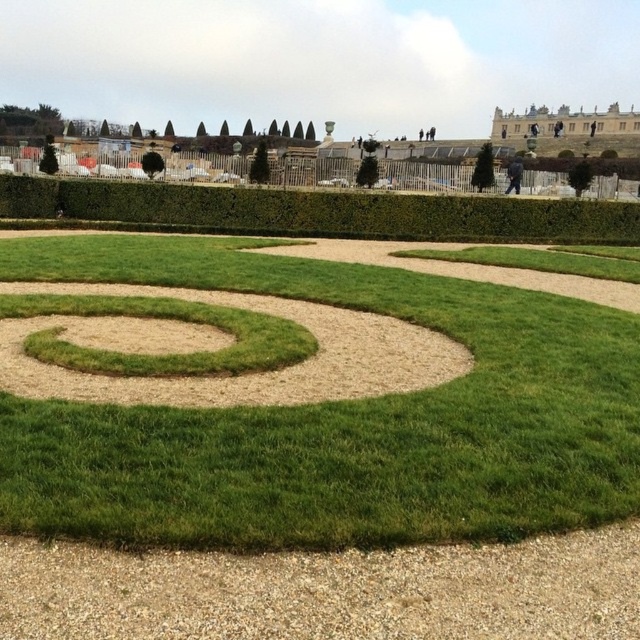
Can you confirm if gray gravel at bottom is shorter than green grass spiral at center?

In fact, gray gravel at bottom may be taller than green grass spiral at center.

Between gray gravel at bottom and green grass spiral at center, which one has more height?

gray gravel at bottom is taller.

This screenshot has width=640, height=640. In order to click on gray gravel at bottom in this screenshot , I will do `click(326, 592)`.

This screenshot has width=640, height=640. I want to click on gray gravel at bottom, so click(326, 592).

Is point (48, 180) closer to camera compared to point (445, 368)?

No.

You are a GUI agent. You are given a task and a screenshot of the screen. Output one action in this format:
    pyautogui.click(x=<x>, y=<y>)
    Task: Click on the green hedge at upper center
    Image resolution: width=640 pixels, height=640 pixels.
    Given the screenshot: What is the action you would take?
    pyautogui.click(x=317, y=212)

The height and width of the screenshot is (640, 640). In order to click on green hedge at upper center in this screenshot , I will do `click(317, 212)`.

Does green grass at center have a lesser width compared to gray gravel at bottom?

In fact, green grass at center might be wider than gray gravel at bottom.

Is green grass at center shorter than gray gravel at bottom?

No.

Where is `green grass at center`? This screenshot has height=640, width=640. green grass at center is located at coordinates (337, 420).